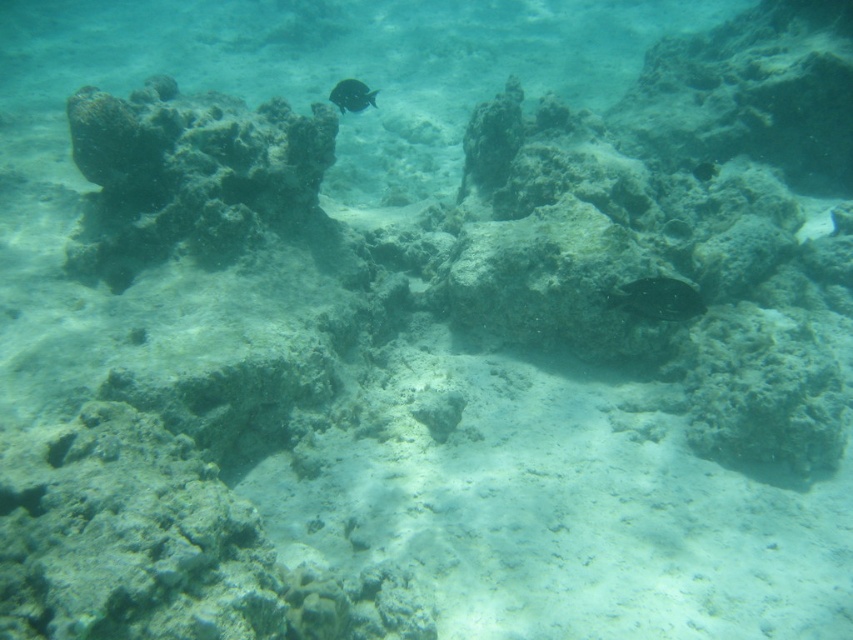
Question: Is shiny green fish at center wider than shiny black fish at center?

Choices:
 (A) no
 (B) yes

Answer: (B)

Question: Can you confirm if dark brown coral at upper left is positioned to the left of shiny black fish at center?

Choices:
 (A) yes
 (B) no

Answer: (A)

Question: Which object appears closest to the camera in this image?

Choices:
 (A) shiny green fish at center
 (B) shiny black fish at center
 (C) dark brown coral at upper left

Answer: (A)

Question: Which of these objects is positioned farthest from the dark brown coral at upper left?

Choices:
 (A) shiny green fish at center
 (B) shiny black fish at center

Answer: (A)

Question: Among these points, which one is nearest to the camera?

Choices:
 (A) (643, 305)
 (B) (169, 134)

Answer: (A)

Question: Does dark brown coral at upper left appear on the right side of shiny green fish at center?

Choices:
 (A) no
 (B) yes

Answer: (A)